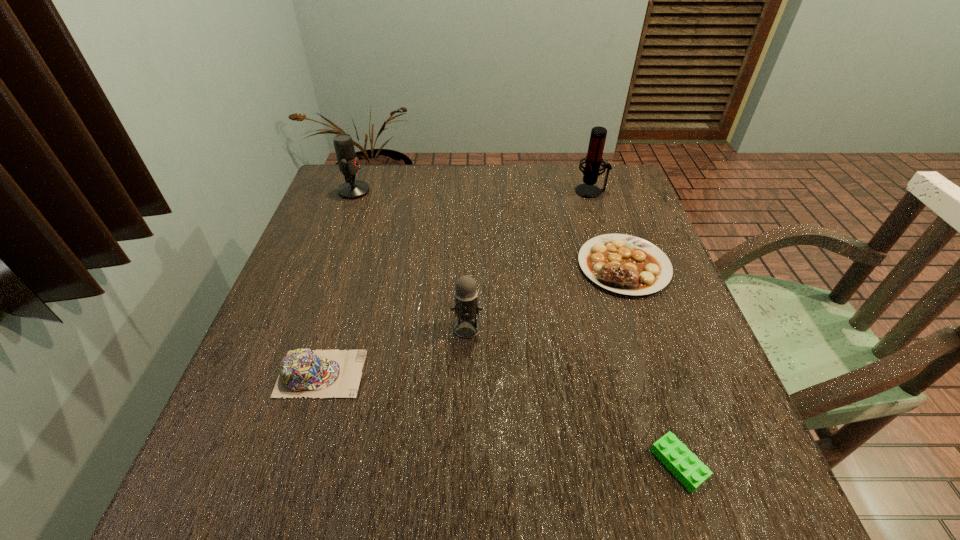
Where is `the rightmost microphone`? The width and height of the screenshot is (960, 540). the rightmost microphone is located at coordinates coord(593,160).

You are a GUI agent. You are given a task and a screenshot of the screen. Output one action in this format:
    pyautogui.click(x=<x>, y=<y>)
    Task: Click on the leftmost microphone
    
    Given the screenshot: What is the action you would take?
    [x=348, y=164]

Where is `the nearest microphone`? the nearest microphone is located at coordinates (466, 307).

Locate an element on the screen. the second microphone from left to right is located at coordinates (466, 307).

Identify the location of the second nearest object. The image size is (960, 540). (303, 372).

Find the location of `the third shortest object`. the third shortest object is located at coordinates (303, 372).

This screenshot has width=960, height=540. What are the coordinates of `the second shortest object` in the screenshot? It's located at (624, 264).

The image size is (960, 540). I want to click on steak, so click(x=624, y=264).

Find the location of a particular element. The width and height of the screenshot is (960, 540). Lego is located at coordinates (680, 461).

The height and width of the screenshot is (540, 960). Find the location of `the nearest object`. the nearest object is located at coordinates (680, 461).